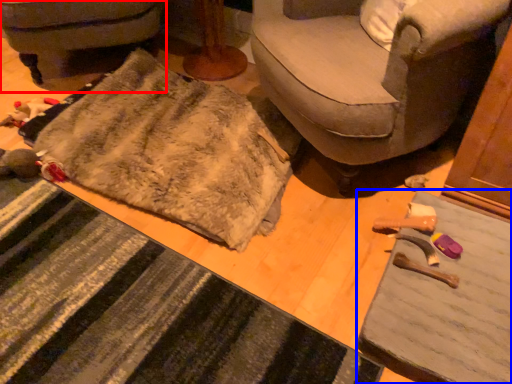
Question: Which of the following is the farthest to the observer, furniture (highlighted by a red box) or table (highlighted by a blue box)?

Choices:
 (A) furniture
 (B) table

Answer: (A)